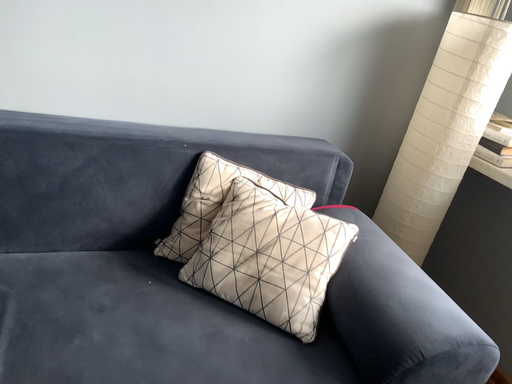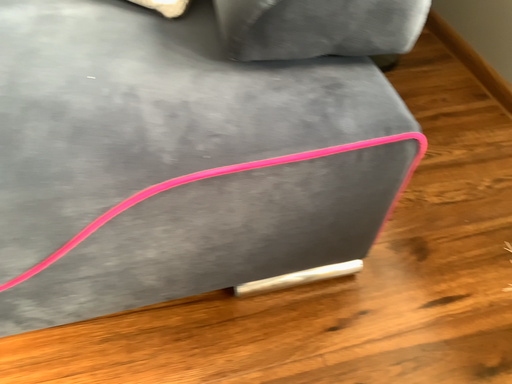
Question: How did the camera likely rotate when shooting the video?

Choices:
 (A) rotated upward
 (B) rotated downward

Answer: (B)